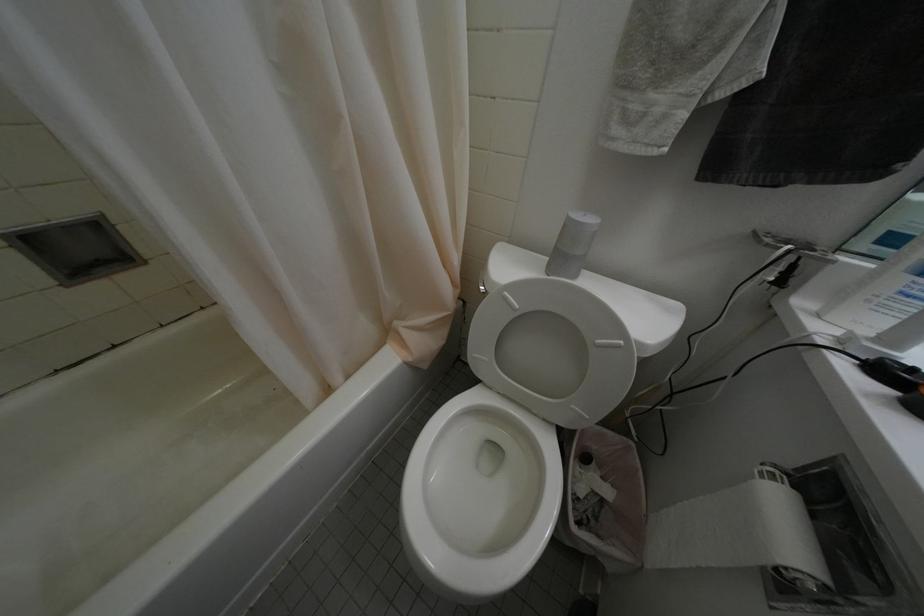
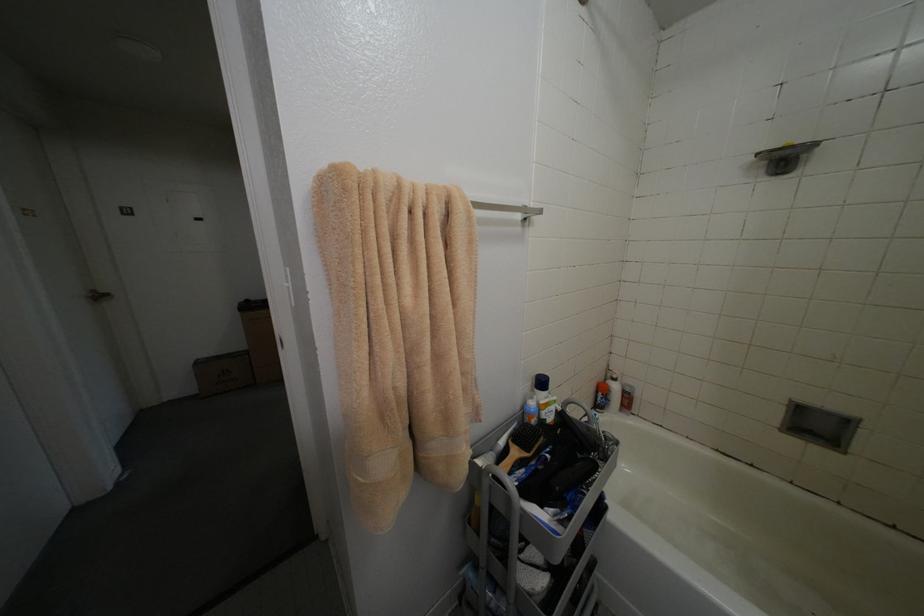
First-person continuous shooting, in which direction is the camera rotating?

The rotation direction of the camera is left-down.